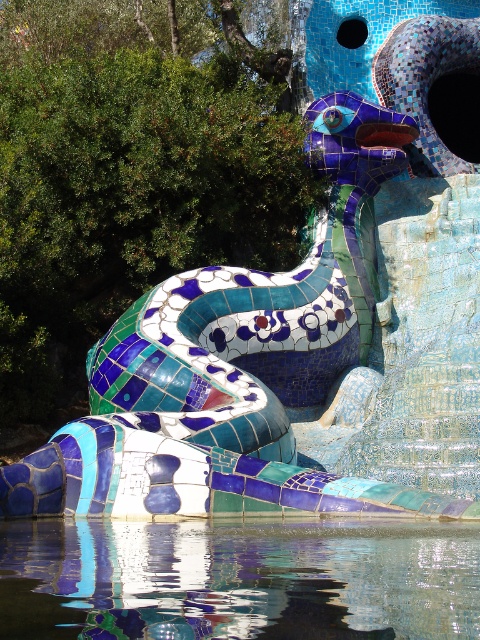
Can you confirm if mosaic tile snake at center is bigger than transparent glass water at lower center?

Yes.

Between point (101, 493) and point (423, 536), which one is positioned in front?

Point (423, 536) is more forward.

I want to click on mosaic tile snake at center, so click(x=236, y=369).